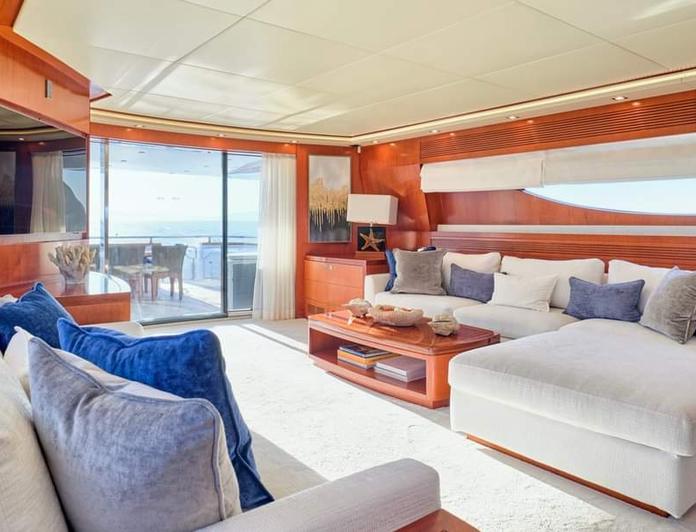
Locate an element on the screen. This screenshot has width=696, height=532. painting is located at coordinates (326, 179).